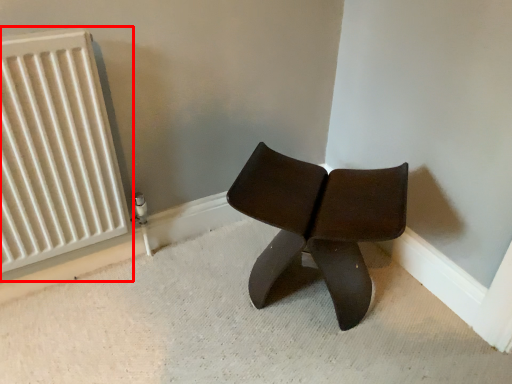
Question: From the image's perspective, considering the relative positions of radiator (annotated by the red box) and chair in the image provided, where is radiator (annotated by the red box) located with respect to the staircase?

Choices:
 (A) below
 (B) above

Answer: (B)